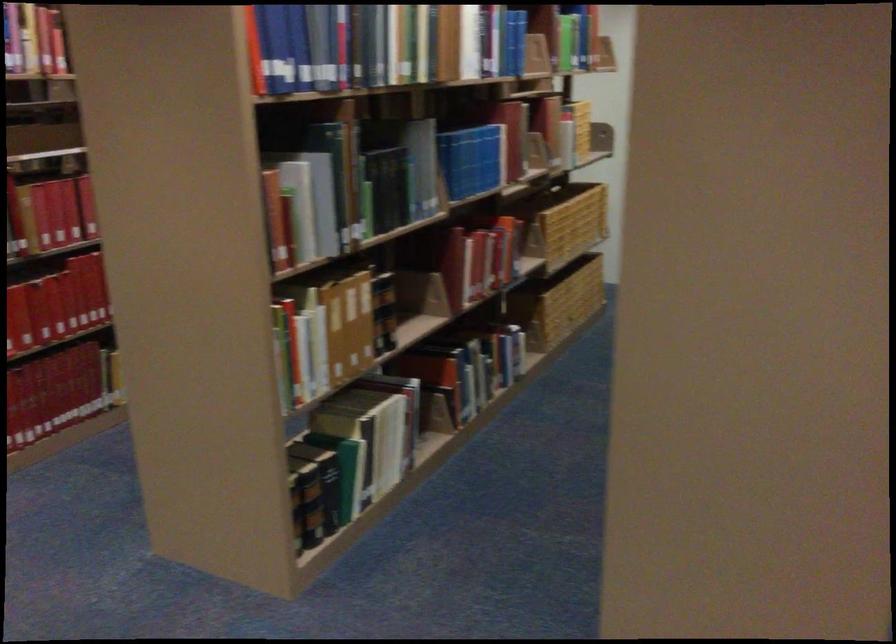
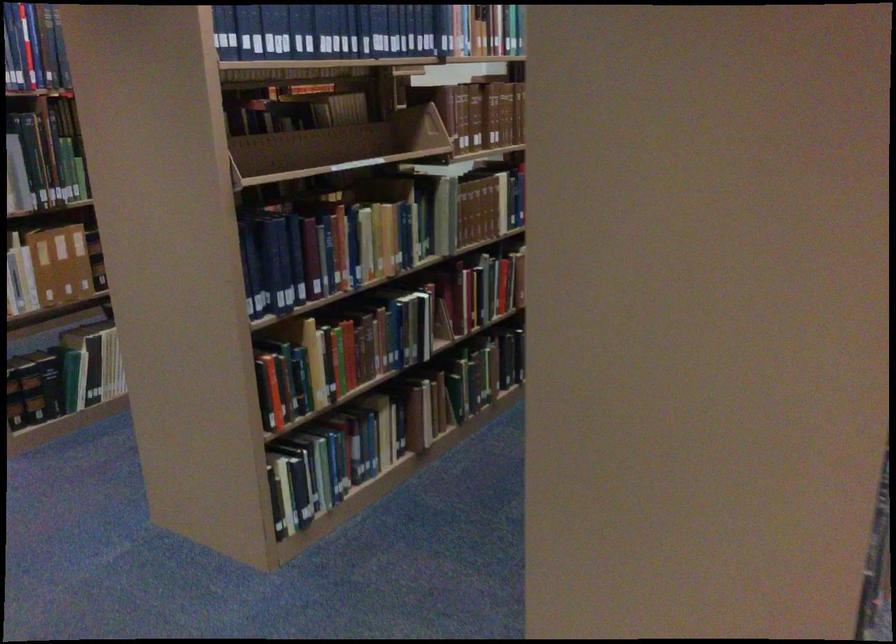
Locate, in the second image, the point that corresponds to the point at 347,476 in the first image.

(70, 379)